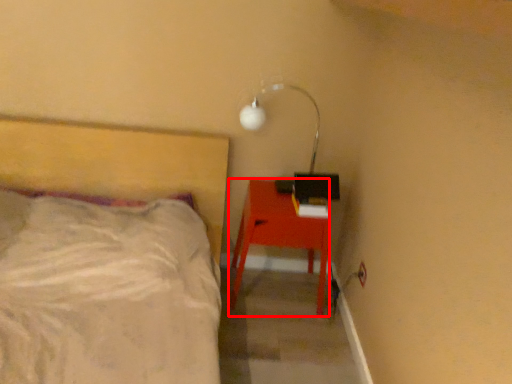
Question: From the image, what is the correct spatial relationship of desk (annotated by the red box) in relation to lamp?

Choices:
 (A) right
 (B) left

Answer: (B)